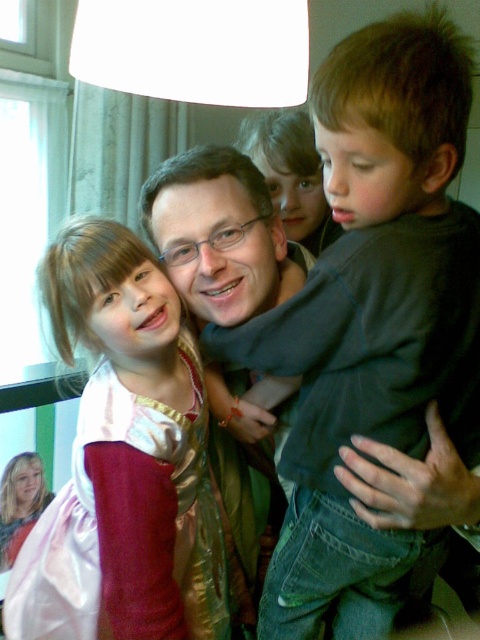
Question: Does pink satin dress at center appear over matte green sweater at center?

Choices:
 (A) no
 (B) yes

Answer: (A)

Question: Does dark green shirt at center have a smaller size compared to pink satin dress at center?

Choices:
 (A) no
 (B) yes

Answer: (A)

Question: Which of the following is the farthest from the observer?

Choices:
 (A) (458, 396)
 (B) (149, 298)

Answer: (B)

Question: Among these objects, which one is nearest to the camera?

Choices:
 (A) pink satin dress at center
 (B) matte green sweater at center

Answer: (A)

Question: Does dark green shirt at center appear over matte green sweater at center?

Choices:
 (A) no
 (B) yes

Answer: (B)

Question: Among these points, which one is nearest to the camera?

Choices:
 (A) (443, 168)
 (B) (108, 577)
 (C) (218, 285)

Answer: (A)